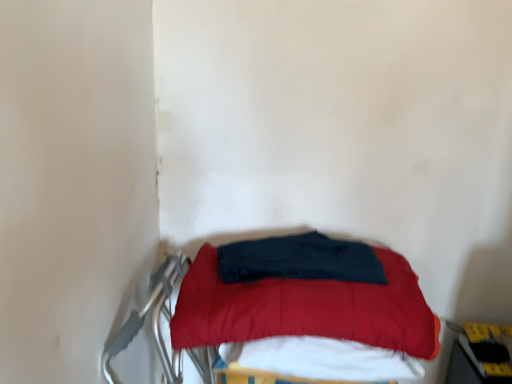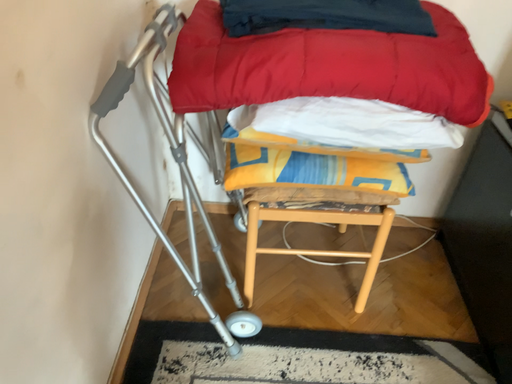
Question: Which way did the camera rotate in the video?

Choices:
 (A) rotated upward
 (B) rotated downward

Answer: (B)